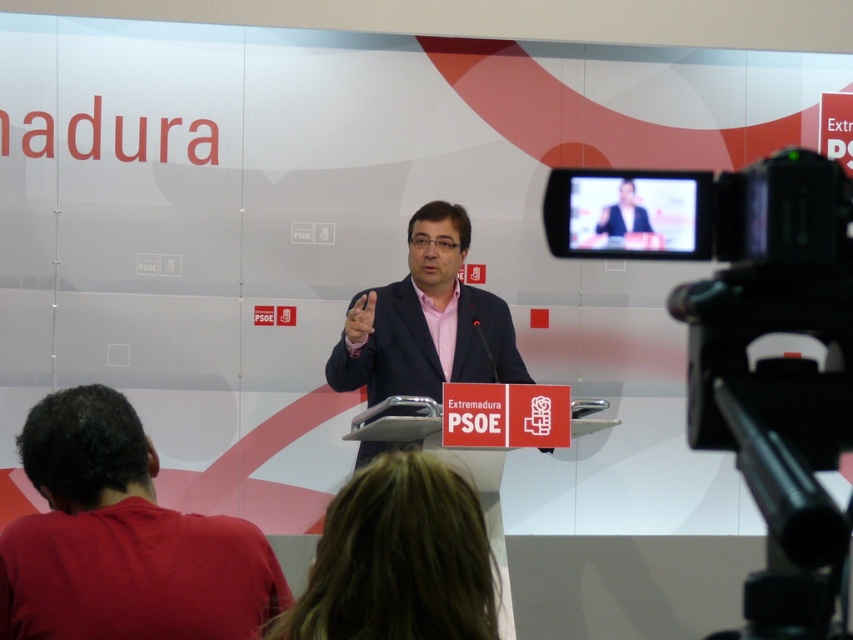
Question: Does black plastic video camera at right appear over pink fabric shirt at center?

Choices:
 (A) yes
 (B) no

Answer: (B)

Question: Which point is farther to the camera?

Choices:
 (A) (621, 182)
 (B) (422, 268)
 (C) (74, 506)
 (D) (834, 230)

Answer: (B)

Question: Which object is positioned farthest from the matte black suit at center?

Choices:
 (A) pink fabric shirt at center
 (B) black plastic video camera at right

Answer: (A)

Question: Can you confirm if black plastic video camera at right is smaller than dark red shirt at lower left?

Choices:
 (A) yes
 (B) no

Answer: (B)

Question: Estimate the real-world distances between objects in this image. Which object is closer to the black plastic video camera at right?

Choices:
 (A) matte black suit at center
 (B) pink fabric shirt at center
 (C) dark red shirt at lower left

Answer: (A)

Question: Does black plastic video camera at right lie behind matte black suit at center?

Choices:
 (A) yes
 (B) no

Answer: (B)